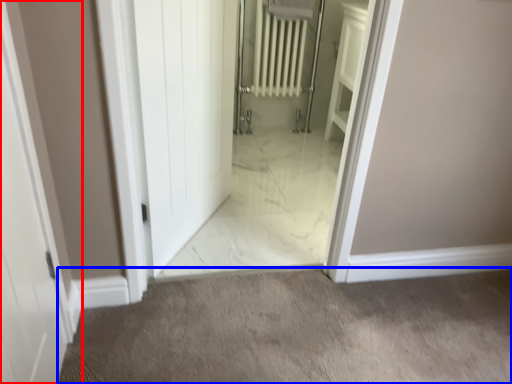
Question: Which of the following is the farthest to the observer, door (highlighted by a red box) or granite (highlighted by a blue box)?

Choices:
 (A) door
 (B) granite

Answer: (B)